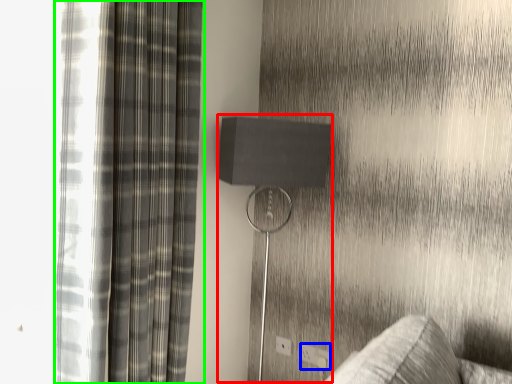
Question: Considering the real-world distances, which object is farthest from table lamp (highlighted by a red box)? electric outlet (highlighted by a blue box) or curtain (highlighted by a green box)?

Choices:
 (A) electric outlet
 (B) curtain

Answer: (A)